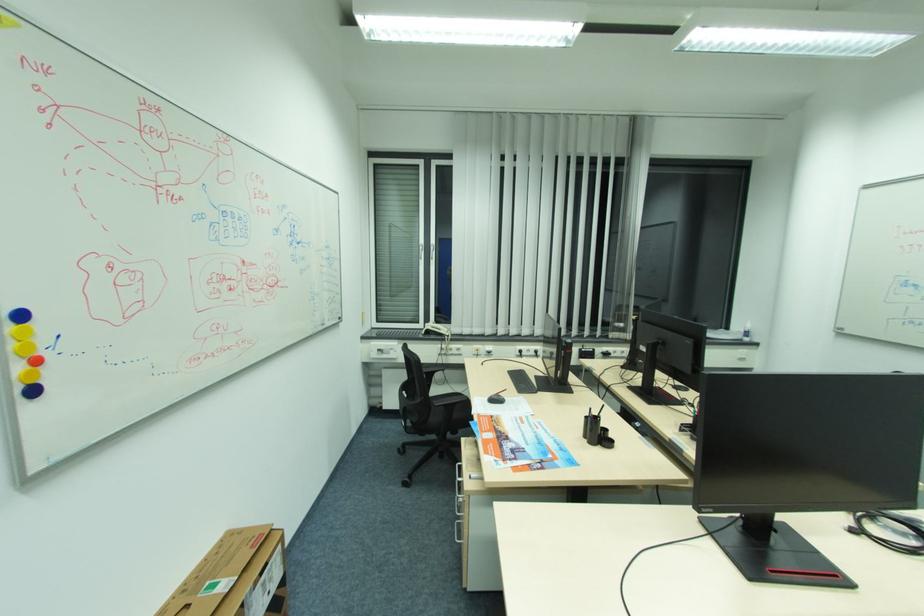
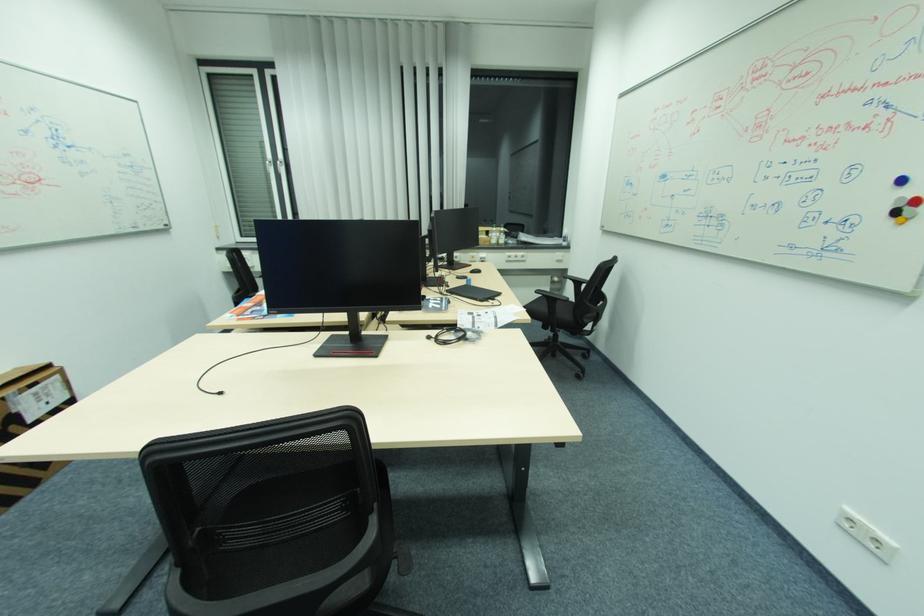
Which direction would the cameraman need to move to produce the second image?

The cameraman moved toward right, backward.